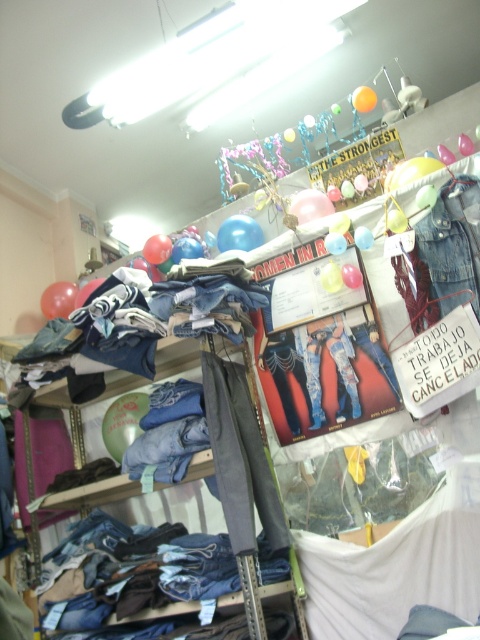
Does point (346, 317) lie behind point (434, 285)?

Yes, it is.

Which is above, denim jeans at center or denim jacket at upper right?

denim jacket at upper right is higher up.

Is point (307, 408) more distant than point (432, 208)?

Yes, it is.

Where is `denim jeans at center`? denim jeans at center is located at coordinates (325, 372).

Consider the image. Does denim jeans at center come in front of orange matte balloon at upper center?

Yes.

Looking at this image, who is positioned more to the right, denim jeans at center or orange matte balloon at upper center?

From the viewer's perspective, orange matte balloon at upper center appears more on the right side.

Does point (300, 404) lie in front of point (362, 93)?

Yes.

At what (x,y) coordinates should I click in order to perform the action: click on denim jeans at center. Please return your answer as a coordinate pair (x, y). The width and height of the screenshot is (480, 640). Looking at the image, I should click on (325, 372).

Can you confirm if denim jacket at upper right is smaller than yellow paper balloon at upper center?

Incorrect, denim jacket at upper right is not smaller in size than yellow paper balloon at upper center.

Does denim jacket at upper right have a greater height compared to yellow paper balloon at upper center?

Indeed, denim jacket at upper right has a greater height compared to yellow paper balloon at upper center.

Is point (445, 241) positioned before point (322, 272)?

Yes, it is in front of point (322, 272).

This screenshot has width=480, height=640. I want to click on denim jacket at upper right, so click(453, 243).